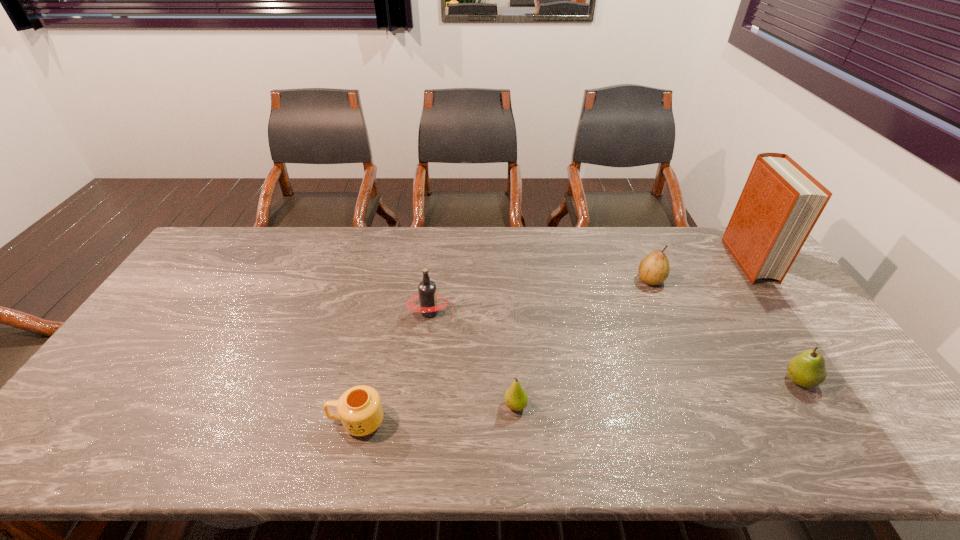
Locate an element on the screen. The image size is (960, 540). object present at the far edge is located at coordinates (780, 203).

Image resolution: width=960 pixels, height=540 pixels. In order to click on object at the near edge in this screenshot , I will do `click(360, 410)`.

The height and width of the screenshot is (540, 960). Find the location of `hardback book at the right edge`. hardback book at the right edge is located at coordinates (780, 203).

Where is `pear present at the right edge`? The image size is (960, 540). pear present at the right edge is located at coordinates (807, 369).

The image size is (960, 540). I want to click on object located in the far right corner section of the desktop, so click(x=780, y=203).

Locate an element on the screen. vacant space at the far edge of the desktop is located at coordinates (616, 252).

In order to click on free location at the near edge of the desktop in this screenshot , I will do `click(762, 459)`.

Identify the location of blank space at the left edge of the desktop. This screenshot has width=960, height=540. (209, 310).

Where is `vacant area at the right edge of the desktop`? vacant area at the right edge of the desktop is located at coordinates click(873, 399).

In the image, there is a desktop. Where is `vacant space at the far left corner`? This screenshot has width=960, height=540. vacant space at the far left corner is located at coordinates 196,261.